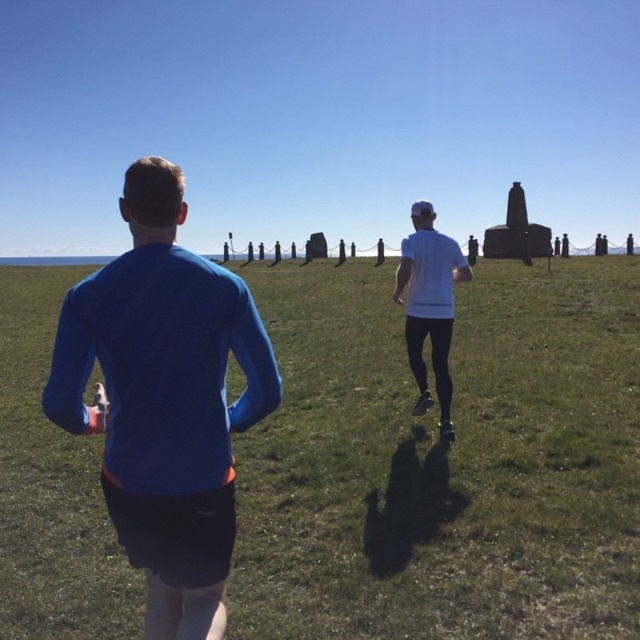
Question: Can you confirm if green grass at center is positioned to the right of blue fabric shirt at center?

Choices:
 (A) no
 (B) yes

Answer: (A)

Question: Which of the following is the closest to the observer?

Choices:
 (A) (400, 637)
 (B) (419, 385)
 (C) (234, 284)

Answer: (C)

Question: From the image, what is the correct spatial relationship of blue fabric shirt at center in relation to white matte shirt at center?

Choices:
 (A) left
 (B) right

Answer: (A)

Question: Which point appears farthest from the camera in this image?

Choices:
 (A) (298, 317)
 (B) (202, 307)
 (C) (449, 298)

Answer: (A)

Question: Does green grass at center come behind blue fabric shirt at center?

Choices:
 (A) yes
 (B) no

Answer: (A)

Question: Which point is farther to the camera?

Choices:
 (A) blue fabric shirt at center
 (B) white matte shirt at center

Answer: (B)